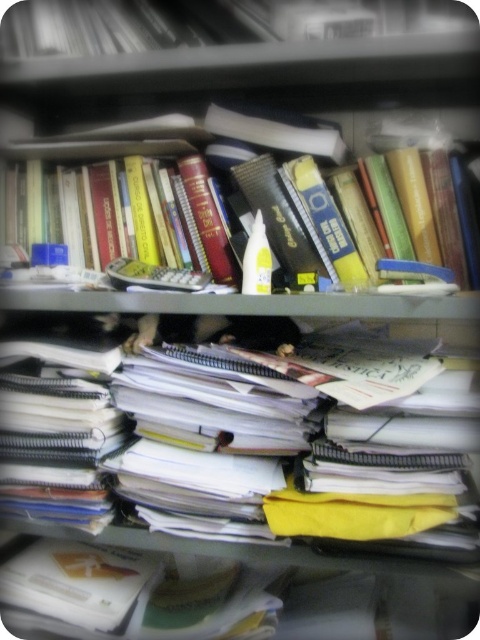
Is point (235, 508) positioned in front of point (35, 148)?

That is True.

This screenshot has height=640, width=480. Find the location of `white paper notebook at center`. white paper notebook at center is located at coordinates (247, 448).

The image size is (480, 640). Describe the element at coordinates (247, 448) in the screenshot. I see `white paper notebook at center` at that location.

At what (x,y) coordinates should I click in order to perform the action: click on white paper notebook at center. Please return your answer as a coordinate pair (x, y). This screenshot has width=480, height=640. Looking at the image, I should click on (247, 448).